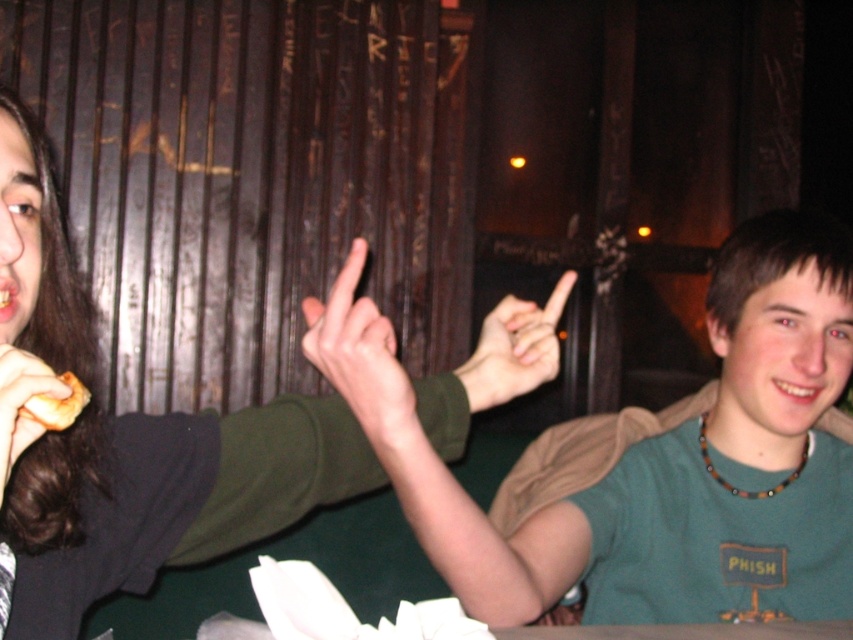
You are a photographer trying to capture a closeup of the matte brown hair at left without including the matte green sweater at upper left in the frame. Based on their positions, is this possible?

The matte green sweater at upper left might be wider than matte brown hair at left, so it might block the view of the matte brown hair at left. To avoid including the matte green sweater at upper left, you might need to adjust your angle or position to frame the matte brown hair at left separately.

Consider the image. You are at a restaurant table and want to place a small vase between the two points, point (436, 509) and point (32, 424). Based on their positions, which point should the vase be closer to if it needs to be placed behind the second point?

The vase should be placed closer to point (32, 424) because point (436, 509) is behind it, so placing the vase near point (32, 424) ensures it is behind the second point.